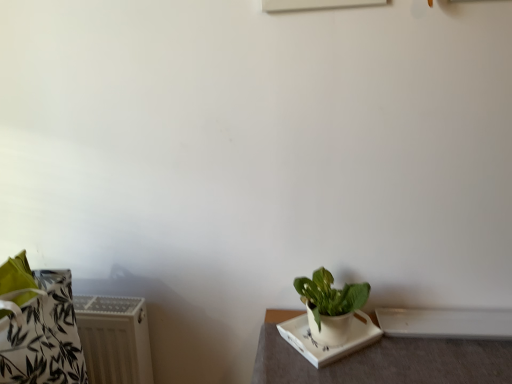
I want to click on free space above white ceramic tray at lower right (from a real-world perspective), so click(x=393, y=353).